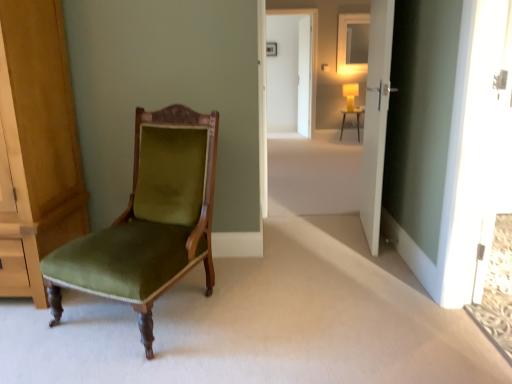
Question: Is white matte door at center, the first door when ordered from front to back, situated inside matte white desk at center or outside?

Choices:
 (A) inside
 (B) outside

Answer: (B)

Question: Is white matte door at center, the second door positioned from the top, to the left or to the right of matte white desk at center in the image?

Choices:
 (A) right
 (B) left

Answer: (B)

Question: Which is nearer to the white glossy screen door at center?

Choices:
 (A) velvet green chair at left
 (B) matte white picture frame at upper center
 (C) matte white mirror at upper center
 (D) white glossy door at center, the 1th door positioned from the top
 (E) matte yellow lampshade at center

Answer: (D)

Question: Which object is the farthest from the white matte door at center, the first door when ordered from front to back?

Choices:
 (A) white glossy door at center, which appears as the second door when ordered from the bottom
 (B) matte yellow lampshade at center
 (C) velvet green chair at left
 (D) white glossy screen door at center
 (E) matte white desk at center

Answer: (E)